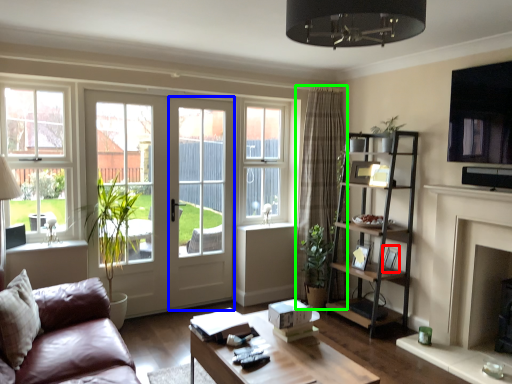
Question: Based on their relative distances, which object is nearer to picture frame (highlighted by a red box)? Choose from screen door (highlighted by a blue box) and curtain (highlighted by a green box).

Choices:
 (A) screen door
 (B) curtain

Answer: (B)